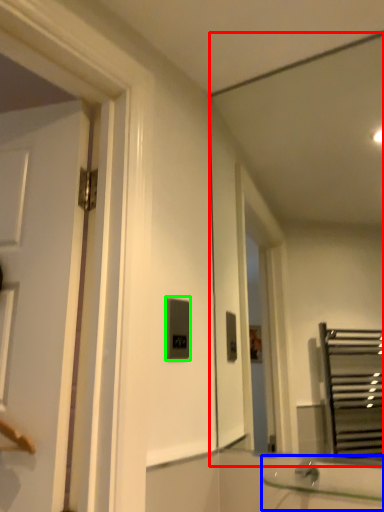
Question: Estimate the real-world distances between objects in this image. Which object is farther from mirror (highlighted by a red box), sink (highlighted by a blue box) or light switch (highlighted by a green box)?

Choices:
 (A) sink
 (B) light switch

Answer: (A)